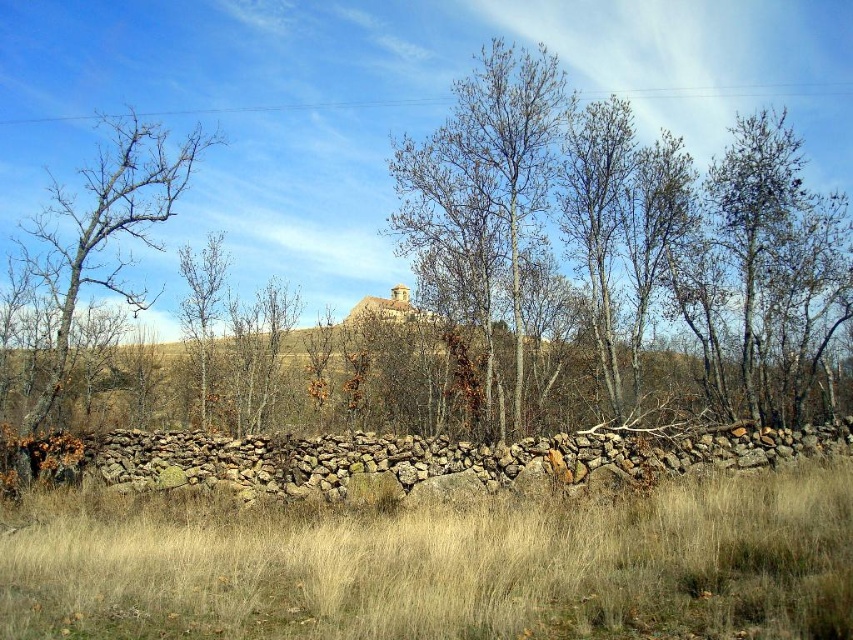
You are a farmer checking the field. You notice the dry grass at lower center and the brown bark tree at left. Which one covers a bigger area in the field?

The dry grass at lower center is larger in size than the brown bark tree at left, so it covers a bigger area in the field.

You are a bird looking for a nesting spot. You see a bare wood tree at center and a brown bark tree at left. Which tree is taller and would provide a better vantage point?

The bare wood tree at center is taller than the brown bark tree at left, so it would provide a better vantage point for nesting.